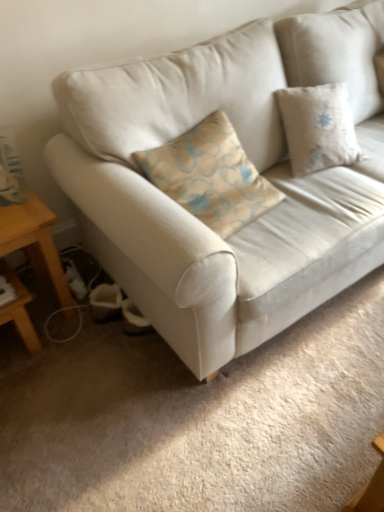
What do you see at coordinates (35, 243) in the screenshot?
I see `wooden table at lower left` at bounding box center [35, 243].

This screenshot has width=384, height=512. I want to click on wooden table at lower left, so click(35, 243).

Where is `suede-like beige couch at center`? suede-like beige couch at center is located at coordinates (253, 163).

Measure the distance between suede-like beige couch at center and camera.

The depth of suede-like beige couch at center is 1.10 meters.

What do you see at coordinates (253, 163) in the screenshot? This screenshot has height=512, width=384. I see `suede-like beige couch at center` at bounding box center [253, 163].

In order to face suede-like beige couch at center, should I rotate leftwards or rightwards?

You should look right and rotate roughly 16.657 degrees.

Locate an element on the screen. The width and height of the screenshot is (384, 512). wooden table at lower left is located at coordinates pos(35,243).

Which object is positioned more to the right, suede-like beige couch at center or wooden table at lower left?

suede-like beige couch at center is more to the right.

Looking at this image, is suede-like beige couch at center positioned in front of wooden table at lower left?

Yes, it is in front of wooden table at lower left.

Is point (356, 104) closer to camera compared to point (28, 237)?

No, it is behind (28, 237).

From the image's perspective, does suede-like beige couch at center appear higher than wooden table at lower left?

Indeed, from the image's perspective, suede-like beige couch at center is shown above wooden table at lower left.

From a real-world perspective, who is located higher, suede-like beige couch at center or wooden table at lower left?

suede-like beige couch at center, from a real-world perspective.

Looking at this image, in terms of width, does suede-like beige couch at center look wider or thinner when compared to wooden table at lower left?

Considering their sizes, suede-like beige couch at center looks broader than wooden table at lower left.

Does suede-like beige couch at center have a lesser height compared to wooden table at lower left?

Incorrect, the height of suede-like beige couch at center does not fall short of that of wooden table at lower left.

Considering the sizes of suede-like beige couch at center and wooden table at lower left in the image, is suede-like beige couch at center bigger or smaller than wooden table at lower left?

Clearly, suede-like beige couch at center is larger in size than wooden table at lower left.

Could wooden table at lower left be considered to be inside suede-like beige couch at center?

No, suede-like beige couch at center does not contain wooden table at lower left.

Is there a large distance between suede-like beige couch at center and wooden table at lower left?

They are positioned close to each other.

Is suede-like beige couch at center aimed at wooden table at lower left?

No, suede-like beige couch at center is not aimed at wooden table at lower left.

Locate an element on the screen. table that is on the left side of suede-like beige couch at center is located at coordinates (35, 243).

Considering the positions of objects wooden table at lower left and suede-like beige couch at center in the image provided, who is more to the right, wooden table at lower left or suede-like beige couch at center?

suede-like beige couch at center.

Which object is more forward, wooden table at lower left or suede-like beige couch at center?

suede-like beige couch at center is more forward.

Which is in front, point (8, 269) or point (300, 181)?

Point (300, 181)

From the image's perspective, relative to suede-like beige couch at center, is wooden table at lower left above or below?

Based on their image positions, wooden table at lower left is located beneath suede-like beige couch at center.

From a real-world perspective, between wooden table at lower left and suede-like beige couch at center, who is vertically higher?

suede-like beige couch at center, from a real-world perspective.

Looking at their sizes, would you say wooden table at lower left is wider or thinner than suede-like beige couch at center?

In the image, wooden table at lower left appears to be more narrow than suede-like beige couch at center.

In terms of height, does wooden table at lower left look taller or shorter compared to suede-like beige couch at center?

wooden table at lower left is shorter than suede-like beige couch at center.

Is wooden table at lower left smaller than suede-like beige couch at center?

Correct, wooden table at lower left occupies less space than suede-like beige couch at center.

Is suede-like beige couch at center surrounded by wooden table at lower left?

No, wooden table at lower left does not contain suede-like beige couch at center.

Is wooden table at lower left touching suede-like beige couch at center?

wooden table at lower left and suede-like beige couch at center are not in contact.

Is suede-like beige couch at center at the back of wooden table at lower left?

wooden table at lower left does not have its back to suede-like beige couch at center.

This screenshot has height=512, width=384. I want to click on table below the suede-like beige couch at center (from the image's perspective), so click(x=35, y=243).

You are a GUI agent. You are given a task and a screenshot of the screen. Output one action in this format:
    pyautogui.click(x=<x>, y=<y>)
    Task: Click on the studio couch to the right of wooden table at lower left
    
    Given the screenshot: What is the action you would take?
    pyautogui.click(x=253, y=163)

Locate an element on the screen. The image size is (384, 512). table below the suede-like beige couch at center (from the image's perspective) is located at coordinates click(x=35, y=243).